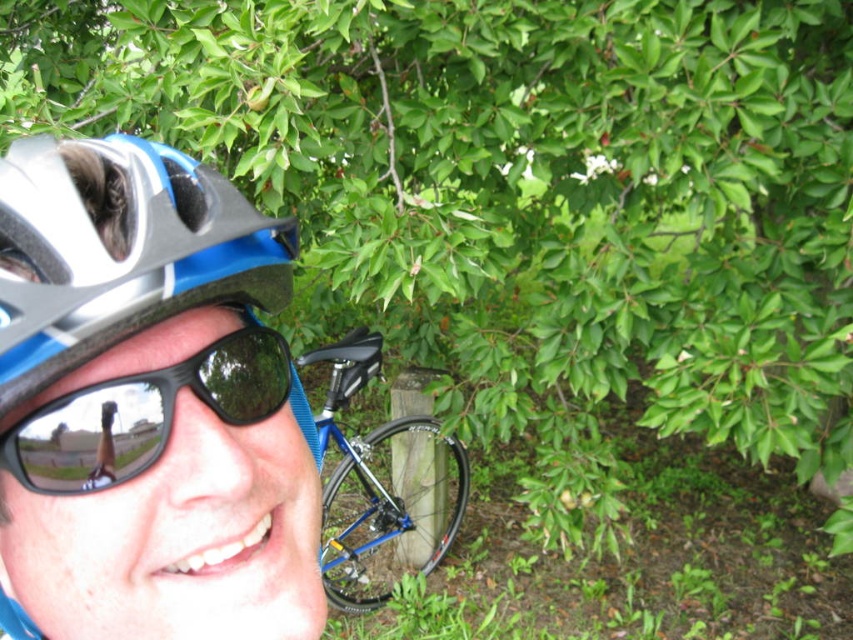
You are taking a photo of the two points mentioned in the scene. Which point, point (219, 280) or point (409, 497), will appear larger in your photo?

Point (219, 280) will appear larger in the photo because it is closer to the camera than point (409, 497).

The person is wearing a matte blue helmet at left and black reflective sunglasses at lower left. Which object is covering part of the other?

The matte blue helmet at left is positioned over the black reflective sunglasses at lower left, so it is covering part of the sunglasses.